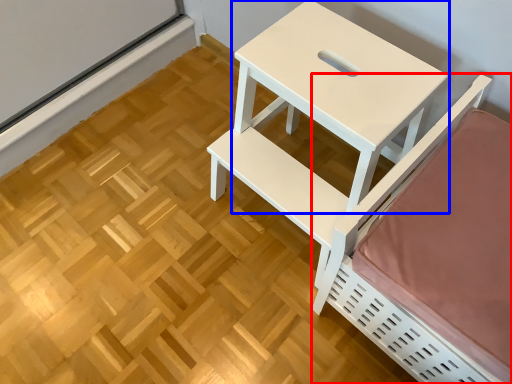
Question: Which of the following is the farthest to the observer, furniture (highlighted by a red box) or table (highlighted by a blue box)?

Choices:
 (A) furniture
 (B) table

Answer: (B)